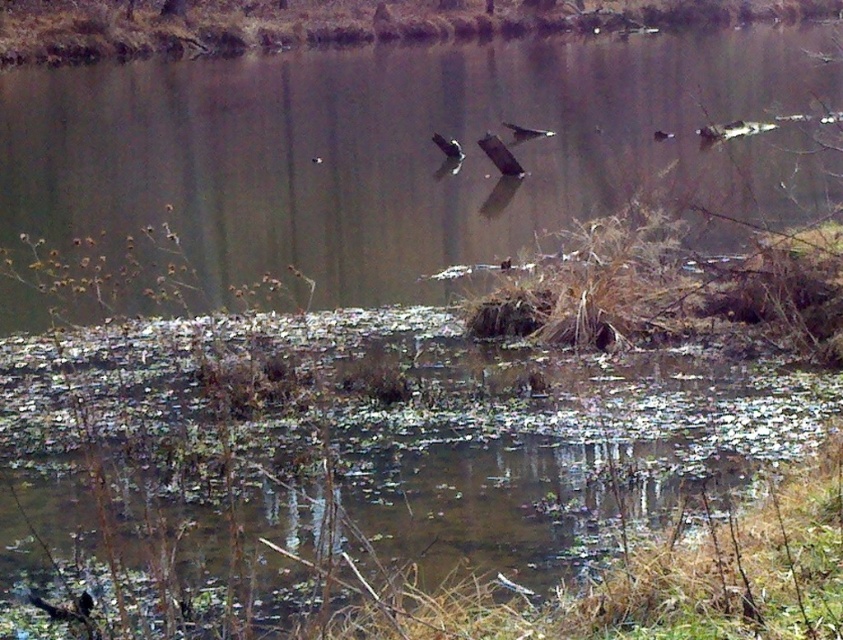
Question: Can you confirm if dark brown feathered bird at upper right is positioned to the right of brown feathered bird at center?

Choices:
 (A) yes
 (B) no

Answer: (A)

Question: Based on their relative distances, which object is farther from the brown feathered bird at right?

Choices:
 (A) dark brown feathers at lower left
 (B) green mossy water at center
 (C) brown feathered bird at center

Answer: (A)

Question: Which of the following is the closest to the observer?

Choices:
 (A) shiny black bird at center
 (B) brown feathered bird at center

Answer: (A)

Question: Which is farther from the green mossy water at center?

Choices:
 (A) dark brown feathered bird at upper right
 (B) dark brown feathered bird at center
 (C) brown murky water at center

Answer: (A)

Question: Does green mossy water at center appear under shiny black bird at center?

Choices:
 (A) no
 (B) yes

Answer: (B)

Question: Can you confirm if white glossy bird at center is positioned above brown feathered bird at right?

Choices:
 (A) no
 (B) yes

Answer: (A)